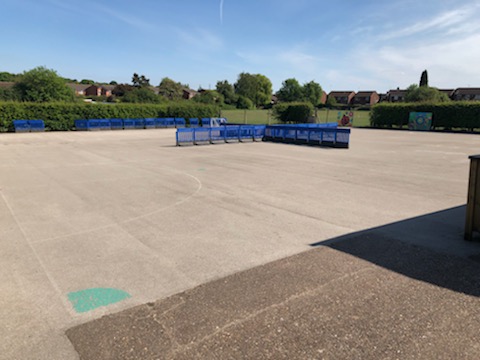
Where is `chimney`? Image resolution: width=480 pixels, height=360 pixels. chimney is located at coordinates (445, 157), (424, 77).